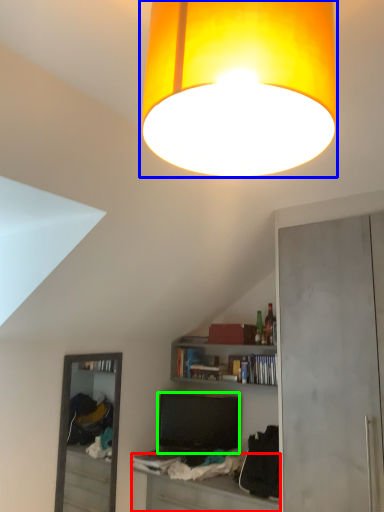
Question: Which object is the farthest from table (highlighted by a red box)? Choose among these: lamp (highlighted by a blue box) or television (highlighted by a green box).

Choices:
 (A) lamp
 (B) television

Answer: (A)